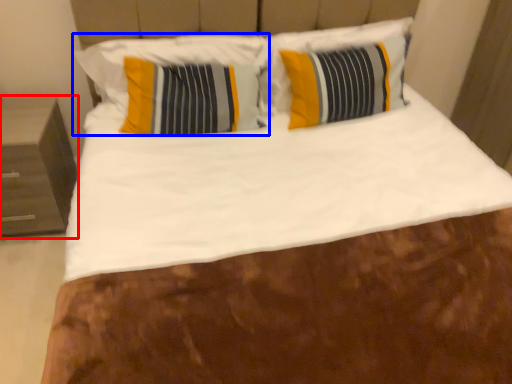
Question: Which object appears farthest to the camera in this image, nightstand (highlighted by a red box) or pillow (highlighted by a blue box)?

Choices:
 (A) nightstand
 (B) pillow

Answer: (B)